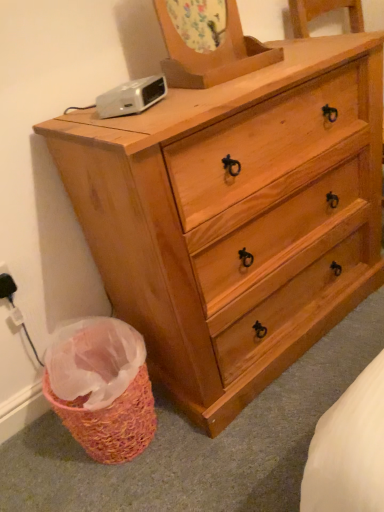
Question: Is black plastic electric outlet at lower left wider or thinner than white plastic clock at upper left?

Choices:
 (A) thin
 (B) wide

Answer: (A)

Question: Is black plastic electric outlet at lower left bigger or smaller than white plastic clock at upper left?

Choices:
 (A) small
 (B) big

Answer: (A)

Question: Which object is the farthest from the white plastic clock at upper left?

Choices:
 (A) natural wood dresser at center
 (B) black plastic electric outlet at lower left

Answer: (B)

Question: Which object is the farthest from the natural wood dresser at center?

Choices:
 (A) white plastic clock at upper left
 (B) black plastic electric outlet at lower left

Answer: (B)